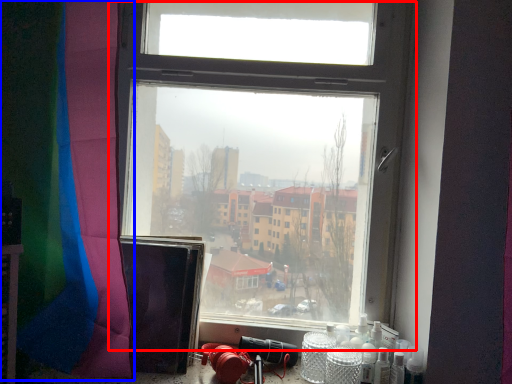
Question: Which point is further to the camera, window (highlighted by a red box) or curtain (highlighted by a blue box)?

Choices:
 (A) window
 (B) curtain

Answer: (A)